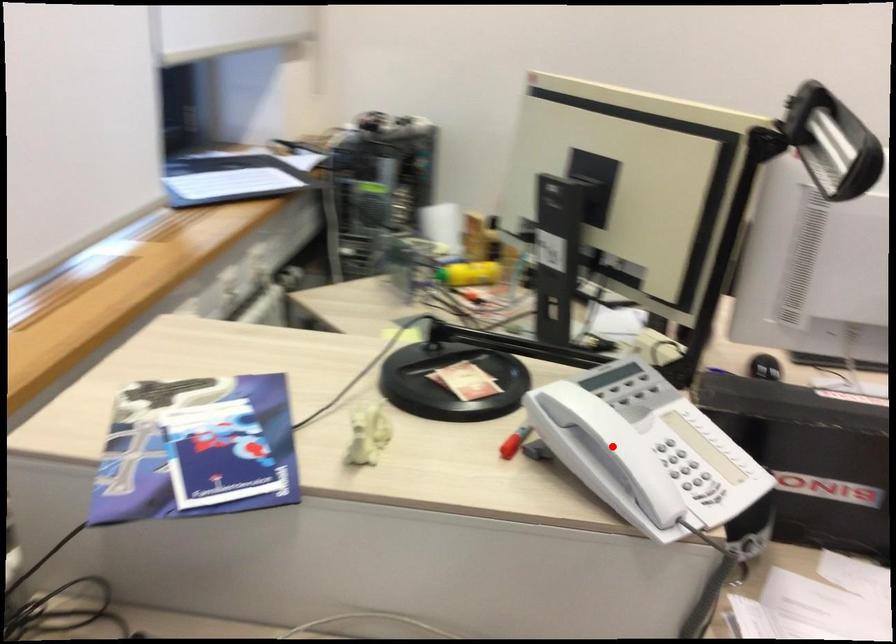
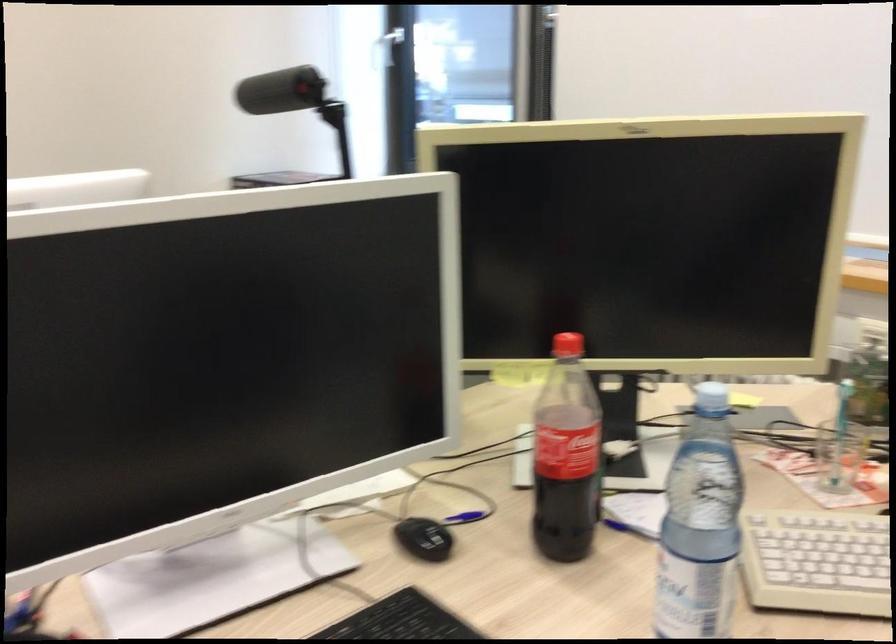
Question: I am providing you with two images of the same scene from different viewpoints. A red point is marked on the first image. Can you still see the location of the red point in image 2?

Choices:
 (A) Yes
 (B) No

Answer: (B)